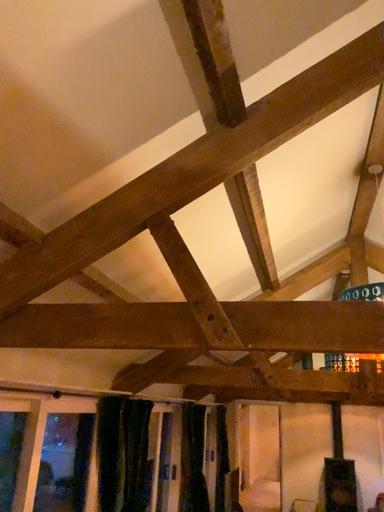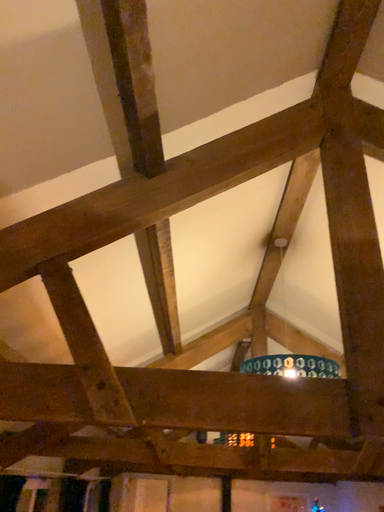
Question: How did the camera likely rotate when shooting the video?

Choices:
 (A) rotated right
 (B) rotated left

Answer: (A)